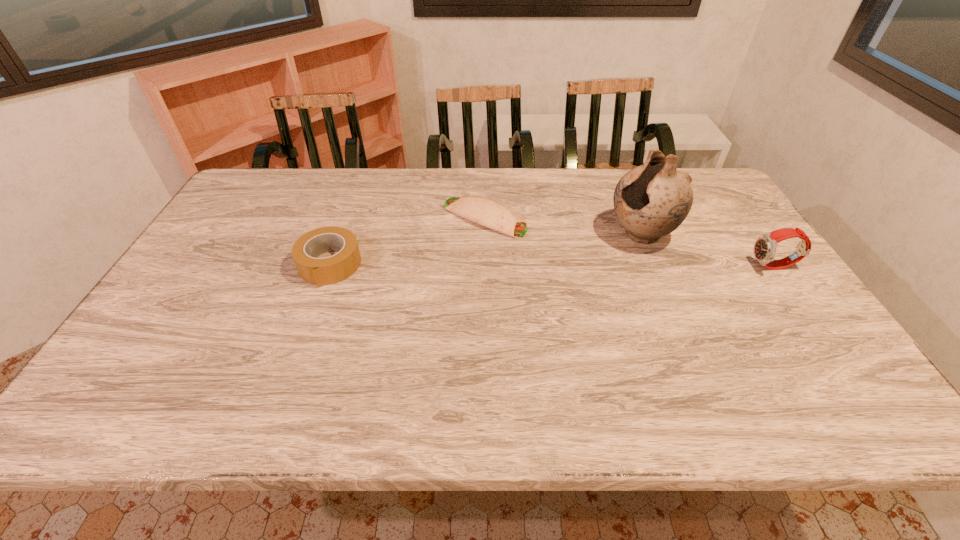
The width and height of the screenshot is (960, 540). What are the coordinates of `the second shortest object` in the screenshot? It's located at (321, 271).

At what (x,y) coordinates should I click in order to perform the action: click on the leftmost object. Please return your answer as a coordinate pair (x, y). This screenshot has width=960, height=540. Looking at the image, I should click on (321, 271).

At what (x,y) coordinates should I click in order to perform the action: click on the third shortest object. Please return your answer as a coordinate pair (x, y). The height and width of the screenshot is (540, 960). Looking at the image, I should click on (765, 246).

This screenshot has width=960, height=540. I want to click on the rightmost object, so click(765, 246).

Locate an element on the screen. the shortest object is located at coordinates (484, 211).

This screenshot has width=960, height=540. In order to click on the second object from left to right in this screenshot , I will do `click(484, 211)`.

I want to click on the tallest object, so click(652, 200).

The height and width of the screenshot is (540, 960). What are the coordinates of `pottery` in the screenshot? It's located at (652, 200).

Where is `vacant area situated at the edge of the second shortest object`? The width and height of the screenshot is (960, 540). vacant area situated at the edge of the second shortest object is located at coordinates (300, 346).

This screenshot has height=540, width=960. Identify the location of vacant space located on the face of the watch. (684, 267).